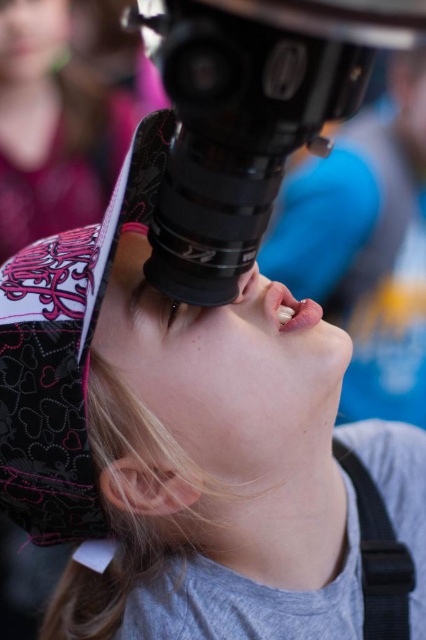
The young girl is using a telescope to observe a distant object. She notices that the black matte telescope at center and the matte black eye at center are 9.02 inches apart. If her eyes can focus on objects no closer than 10 inches, will she be able to see the details clearly through the telescope?

The black matte telescope at center and matte black eye at center are 9.02 inches apart, which is less than the 10 inches minimum focusing distance required. Therefore, the girl will not be able to see the details clearly through the telescope.

Based on the scene description, which object is positioned to the right of the other? The black matte telescope at center or the matte black eye at center?

The black matte telescope at center is positioned to the right of the matte black eye at center.